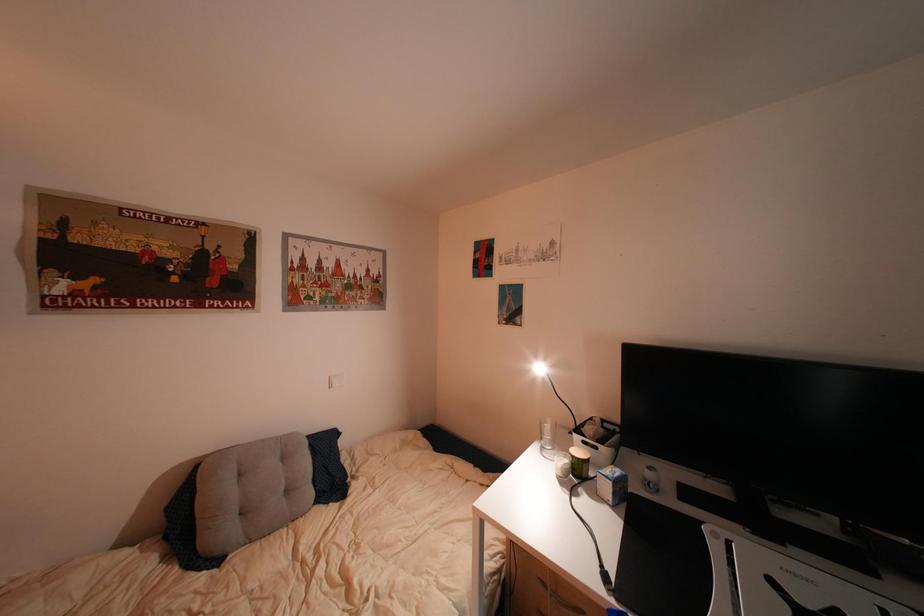
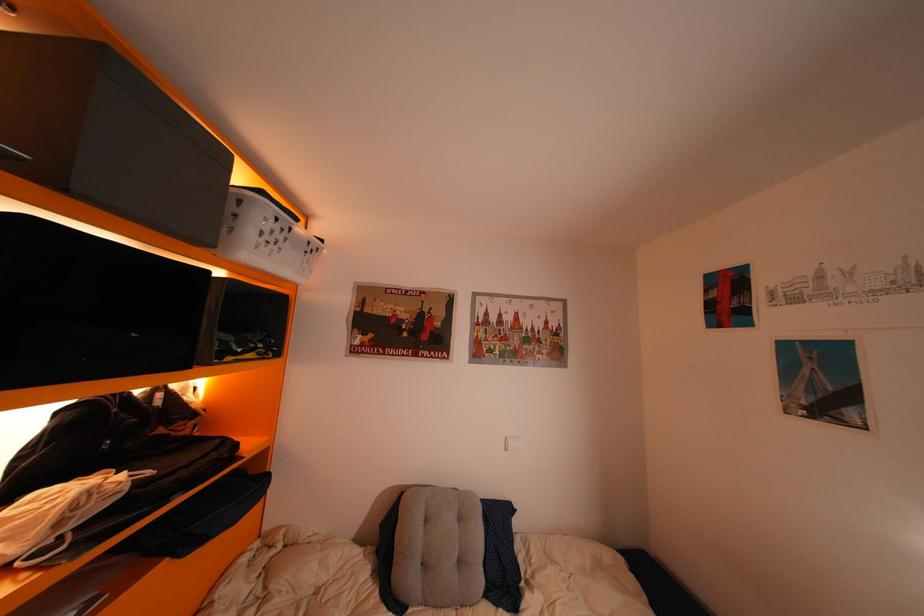
Question: Based on the continuous images, in which direction is the camera rotating? Reply with the corresponding letter.

Choices:
 (A) Left
 (B) Right
 (C) Up
 (D) Down

Answer: (A)